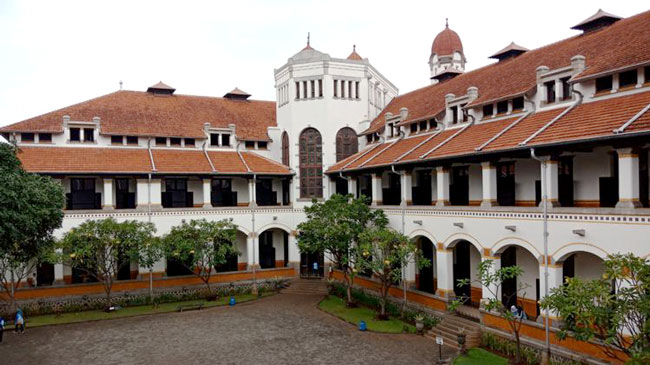
You are a GUI agent. You are given a task and a screenshot of the screen. Output one action in this format:
    pyautogui.click(x=<x>, y=<y>)
    Task: Click on the hotel
    
    Given the screenshot: What is the action you would take?
    pyautogui.click(x=435, y=217)